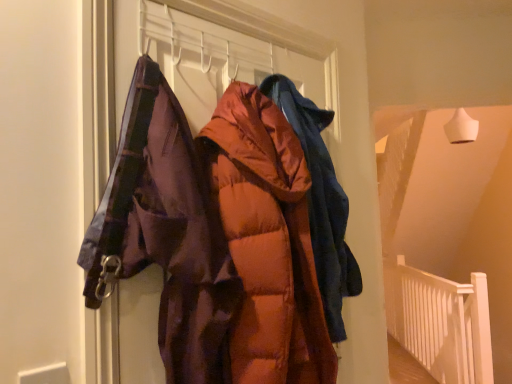
Question: Which direction should I rotate to look at orange puffy jacket at center, the second jacket in the back-to-front sequence?

Choices:
 (A) right
 (B) left

Answer: (A)

Question: Is white wooden balustrade at lower right to the right of orange puffy jacket at center, the 1th jacket from the front, from the viewer's perspective?

Choices:
 (A) no
 (B) yes

Answer: (B)

Question: Is white wooden balustrade at lower right at the left side of orange puffy jacket at center, the second jacket in the back-to-front sequence?

Choices:
 (A) no
 (B) yes

Answer: (A)

Question: Is white wooden balustrade at lower right directly adjacent to orange puffy jacket at center, the second jacket in the back-to-front sequence?

Choices:
 (A) yes
 (B) no

Answer: (B)

Question: Is white wooden balustrade at lower right closer to the viewer compared to orange puffy jacket at center, the second jacket in the back-to-front sequence?

Choices:
 (A) yes
 (B) no

Answer: (B)

Question: Can you confirm if white wooden balustrade at lower right is wider than orange puffy jacket at center, the second jacket in the back-to-front sequence?

Choices:
 (A) yes
 (B) no

Answer: (B)

Question: Is white wooden balustrade at lower right not within orange puffy jacket at center, the 1th jacket from the front?

Choices:
 (A) no
 (B) yes

Answer: (B)

Question: Considering the relative sizes of matte orange puffer jacket at center, the first jacket in the back-to-front sequence, and white wooden balustrade at lower right in the image provided, is matte orange puffer jacket at center, the first jacket in the back-to-front sequence, shorter than white wooden balustrade at lower right?

Choices:
 (A) no
 (B) yes

Answer: (B)

Question: Considering the relative sizes of matte orange puffer jacket at center, the first jacket in the back-to-front sequence, and white wooden balustrade at lower right in the image provided, is matte orange puffer jacket at center, the first jacket in the back-to-front sequence, wider than white wooden balustrade at lower right?

Choices:
 (A) no
 (B) yes

Answer: (B)

Question: From the image's perspective, is matte orange puffer jacket at center, the first jacket in the back-to-front sequence, under white wooden balustrade at lower right?

Choices:
 (A) yes
 (B) no

Answer: (B)

Question: Is matte orange puffer jacket at center, the first jacket in the back-to-front sequence, oriented away from white wooden balustrade at lower right?

Choices:
 (A) no
 (B) yes

Answer: (A)

Question: Does matte orange puffer jacket at center, the first jacket in the back-to-front sequence, lie behind white wooden balustrade at lower right?

Choices:
 (A) no
 (B) yes

Answer: (A)

Question: Is matte orange puffer jacket at center, the first jacket in the back-to-front sequence, at the right side of white wooden balustrade at lower right?

Choices:
 (A) yes
 (B) no

Answer: (B)

Question: From the image's perspective, would you say white wooden balustrade at lower right is shown under matte orange puffer jacket at center, marked as the 2th jacket in a front-to-back arrangement?

Choices:
 (A) no
 (B) yes

Answer: (B)